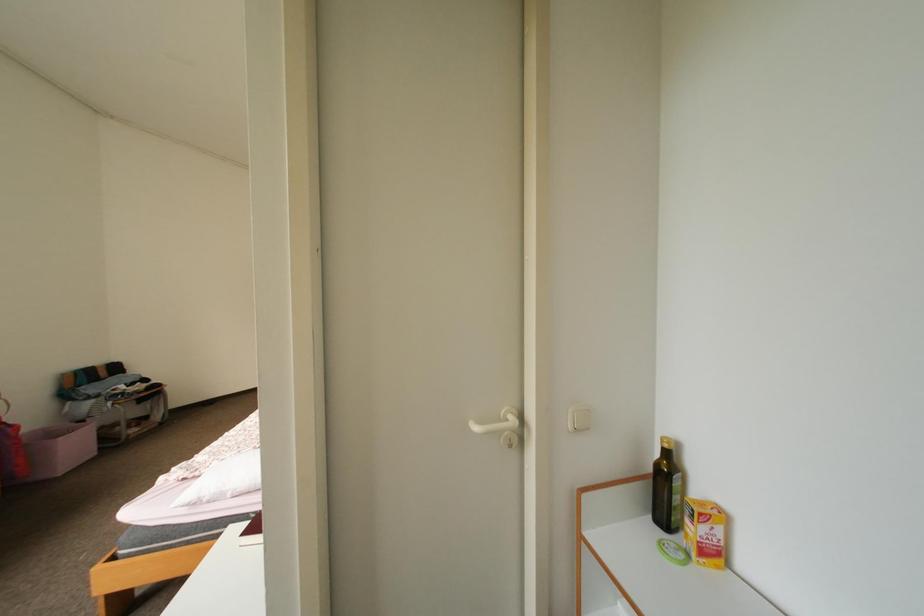
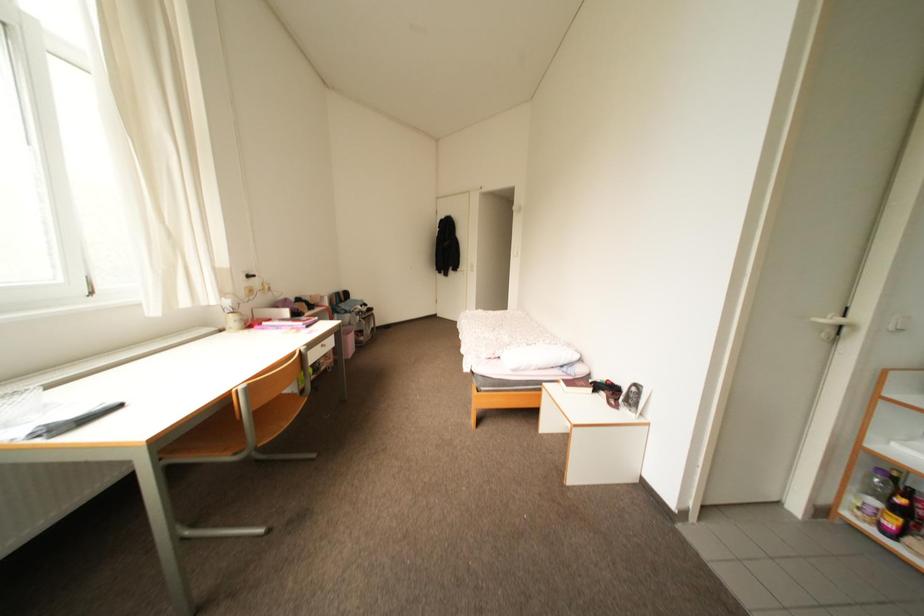
The images are taken continuously from a first-person perspective. In which direction are you moving?

The movement direction of the cameraman is left, backward.